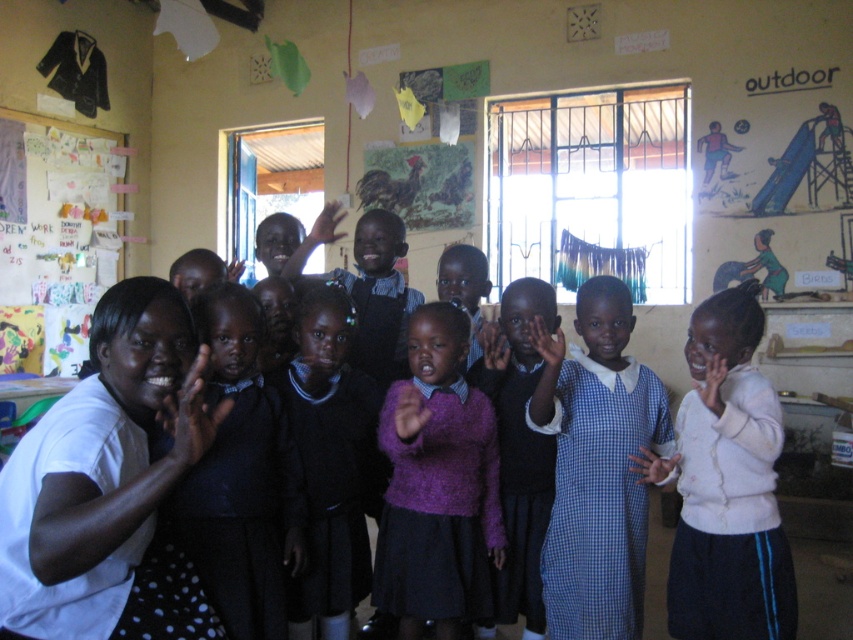
Is point (212, 548) closer to viewer compared to point (321, 224)?

Yes.

Is dark blue dress at center positioned at the back of matte black hand at upper center?

No, it is not.

What do you see at coordinates (242, 477) in the screenshot? I see `dark blue dress at center` at bounding box center [242, 477].

At what (x,y) coordinates should I click in order to perform the action: click on dark blue dress at center. Please return your answer as a coordinate pair (x, y). This screenshot has width=853, height=640. Looking at the image, I should click on (242, 477).

Does matte purple sweater at center have a greater height compared to matte black hand at upper center?

Correct, matte purple sweater at center is much taller as matte black hand at upper center.

Is point (514, 346) positioned after point (328, 202)?

No, (514, 346) is in front of (328, 202).

Find the location of `matte purple sweater at center`. matte purple sweater at center is located at coordinates (518, 451).

Looking at this image, between white soft sweater at center and colored paper collage at upper left, which one appears on the right side from the viewer's perspective?

white soft sweater at center is more to the right.

Does white soft sweater at center have a lesser height compared to colored paper collage at upper left?

Yes.

Is point (698, 460) farther from viewer compared to point (22, 333)?

No.

Find the location of a particular element. The width and height of the screenshot is (853, 640). white soft sweater at center is located at coordinates (727, 484).